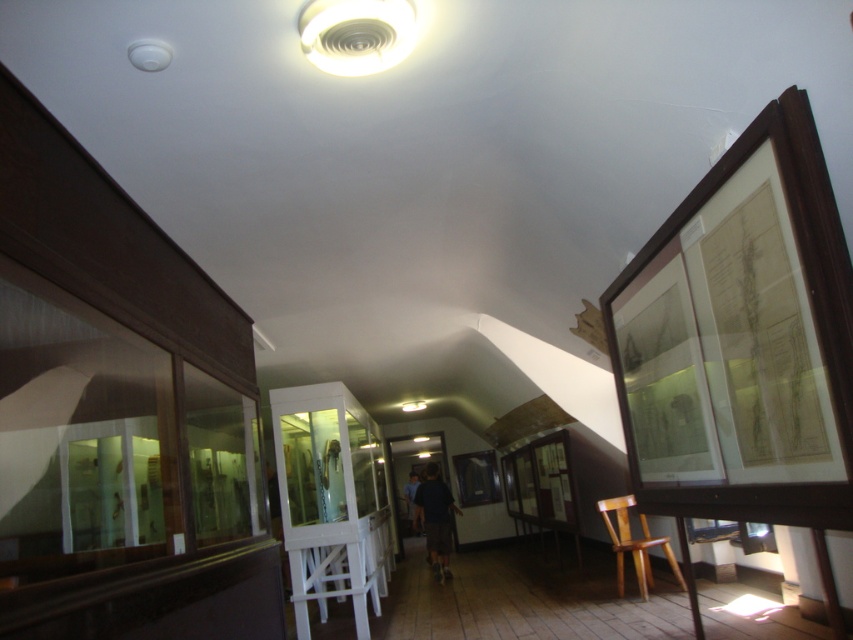
Does white plastic ceiling fan at upper center appear over wooden chair at lower right?

Correct, white plastic ceiling fan at upper center is located above wooden chair at lower right.

Looking at this image, who is positioned more to the left, white plastic ceiling fan at upper center or wooden chair at lower right?

Positioned to the left is white plastic ceiling fan at upper center.

Where is `white plastic ceiling fan at upper center`? The height and width of the screenshot is (640, 853). white plastic ceiling fan at upper center is located at coordinates (357, 33).

Can you confirm if white plastic ceiling fan at upper center is shorter than dark blue shirt at center?

Correct, white plastic ceiling fan at upper center is not as tall as dark blue shirt at center.

Does white plastic ceiling fan at upper center have a greater width compared to dark blue shirt at center?

In fact, white plastic ceiling fan at upper center might be narrower than dark blue shirt at center.

At what (x,y) coordinates should I click in order to perform the action: click on white plastic ceiling fan at upper center. Please return your answer as a coordinate pair (x, y). Looking at the image, I should click on (357, 33).

In order to click on white plastic ceiling fan at upper center in this screenshot , I will do `click(357, 33)`.

Is wooden chair at lower right bigger than dark blue shirt at center?

Incorrect, wooden chair at lower right is not larger than dark blue shirt at center.

Between point (622, 584) and point (427, 467), which one is positioned behind?

Positioned behind is point (427, 467).

You are a GUI agent. You are given a task and a screenshot of the screen. Output one action in this format:
    pyautogui.click(x=<x>, y=<y>)
    Task: Click on the wooden chair at lower right
    
    Given the screenshot: What is the action you would take?
    pyautogui.click(x=634, y=545)